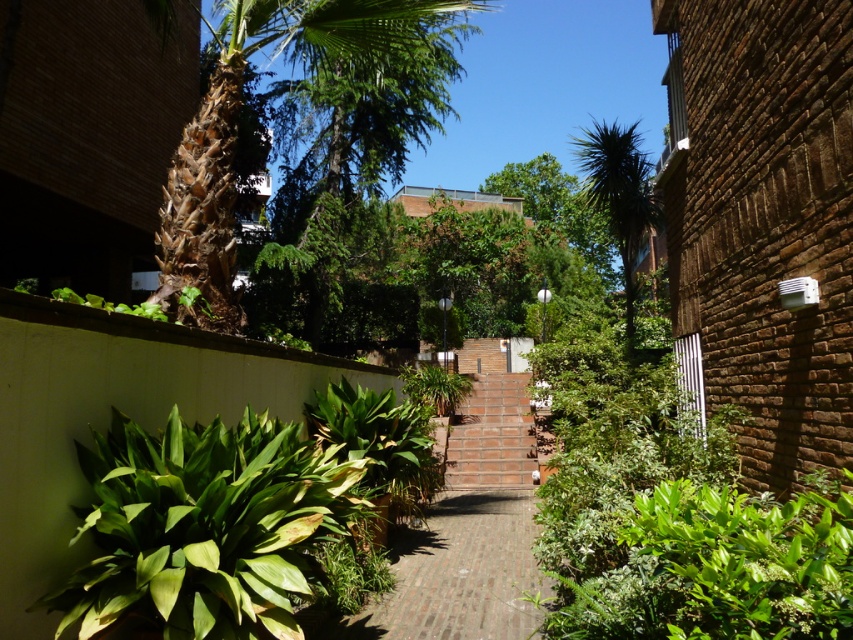
You are a gardener planning to plant a new palm tree between the brown textured palm tree at upper left and the green leafy palm tree at center. The new tree requires a minimum of 50 feet of space between it and the existing trees. Is there enough space for the new tree?

The distance between the brown textured palm tree at upper left and the green leafy palm tree at center is 56.70 feet. Since the new palm tree requires a minimum of 50 feet of space, there is sufficient space to plant the new tree between them.

In the scene shown: You are standing at the center of the courtyard and see a point marked at coordinates (471, 524). What is the material of the surface where this point is located?

The point at coordinates (471, 524) is on brick at center, so the surface material is brick.